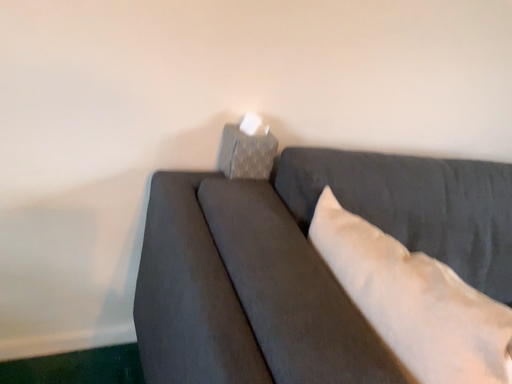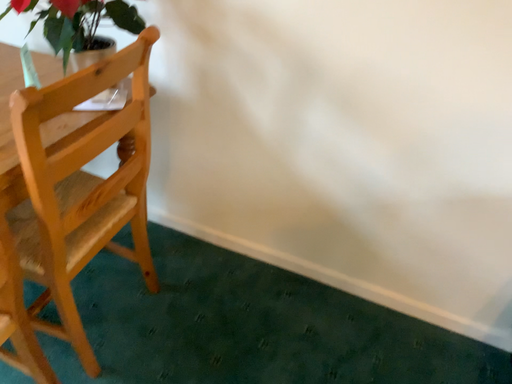
Question: How did the camera likely rotate when shooting the video?

Choices:
 (A) rotated upward
 (B) rotated downward

Answer: (A)